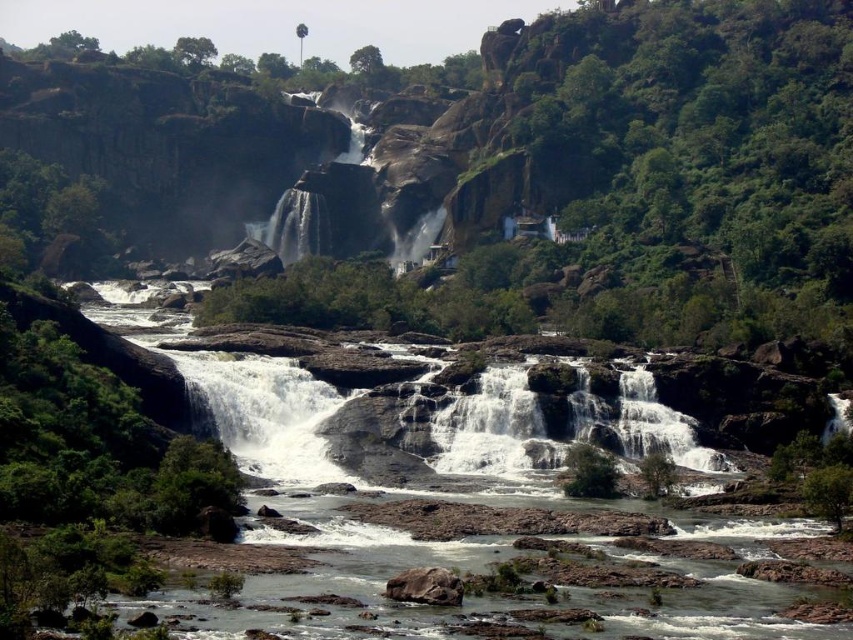
Measure the distance from brown rock river at center to white smooth waterfalls at center.

brown rock river at center is 20.05 feet away from white smooth waterfalls at center.

Who is taller, brown rock river at center or white smooth waterfalls at center?

With more height is brown rock river at center.

At what (x,y) coordinates should I click in order to perform the action: click on brown rock river at center. Please return your answer as a coordinate pair (x, y). Looking at the image, I should click on (380, 477).

Identify the location of brown rock river at center. (380, 477).